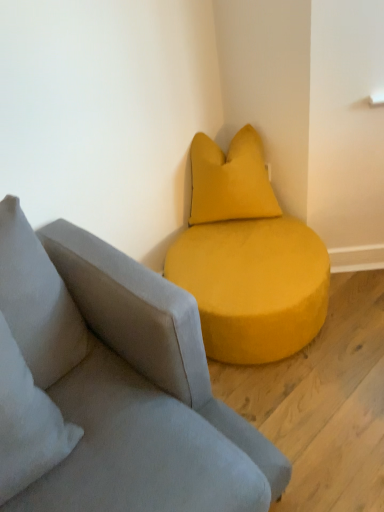
Question: Is suede gray studio couch at center bigger than velvet yellow pillow at upper right?

Choices:
 (A) yes
 (B) no

Answer: (A)

Question: Does suede gray studio couch at center have a smaller size compared to velvet yellow pillow at upper right?

Choices:
 (A) yes
 (B) no

Answer: (B)

Question: Is suede gray studio couch at center oriented away from velvet yellow pillow at upper right?

Choices:
 (A) no
 (B) yes

Answer: (A)

Question: Is suede gray studio couch at center further to the viewer compared to velvet yellow pillow at upper right?

Choices:
 (A) yes
 (B) no

Answer: (B)

Question: Can you confirm if suede gray studio couch at center is shorter than velvet yellow pillow at upper right?

Choices:
 (A) yes
 (B) no

Answer: (A)

Question: Considering the relative positions of suede gray studio couch at center and velvet yellow pillow at upper right in the image provided, is suede gray studio couch at center in front of velvet yellow pillow at upper right?

Choices:
 (A) no
 (B) yes

Answer: (B)

Question: Are velvet yellow pillow at upper right and suede gray studio couch at center making contact?

Choices:
 (A) no
 (B) yes

Answer: (A)

Question: Is velvet yellow pillow at upper right positioned before suede gray studio couch at center?

Choices:
 (A) no
 (B) yes

Answer: (A)

Question: From a real-world perspective, is velvet yellow pillow at upper right below suede gray studio couch at center?

Choices:
 (A) no
 (B) yes

Answer: (A)

Question: From the image's perspective, does velvet yellow pillow at upper right appear higher than suede gray studio couch at center?

Choices:
 (A) no
 (B) yes

Answer: (B)

Question: Does velvet yellow pillow at upper right appear on the left side of suede gray studio couch at center?

Choices:
 (A) no
 (B) yes

Answer: (B)

Question: Does velvet yellow pillow at upper right have a lesser width compared to suede gray studio couch at center?

Choices:
 (A) no
 (B) yes

Answer: (B)

Question: Is point (153, 392) closer or farther from the camera than point (261, 211)?

Choices:
 (A) closer
 (B) farther

Answer: (A)